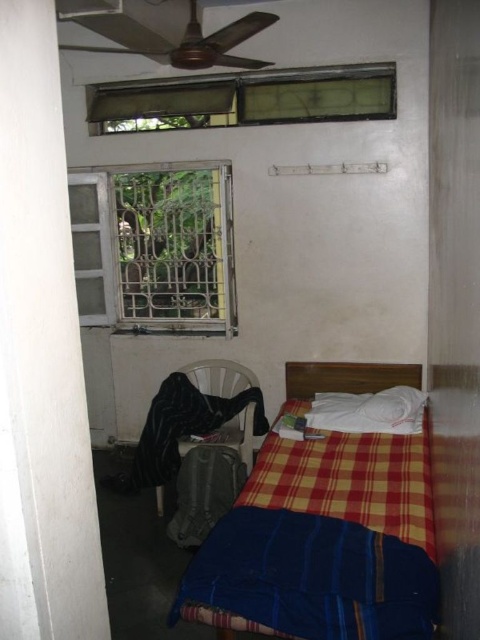
Question: Is blue woven blanket at lower center in front of metallic bars at left?

Choices:
 (A) no
 (B) yes

Answer: (B)

Question: Which object is closer to the camera taking this photo?

Choices:
 (A) blue woven blanket at lower center
 (B) plaid fabric bed at center

Answer: (A)

Question: Which object is closer to the camera taking this photo?

Choices:
 (A) green glass window at upper center
 (B) plaid fabric bedspread at center

Answer: (B)

Question: Which point appears closest to the camera in this image?

Choices:
 (A) (210, 83)
 (B) (383, 547)

Answer: (B)

Question: Is plaid fabric bed at center positioned at the back of plaid fabric bedspread at center?

Choices:
 (A) no
 (B) yes

Answer: (A)

Question: Does blue woven blanket at lower center appear over metallic bars at left?

Choices:
 (A) yes
 (B) no

Answer: (B)